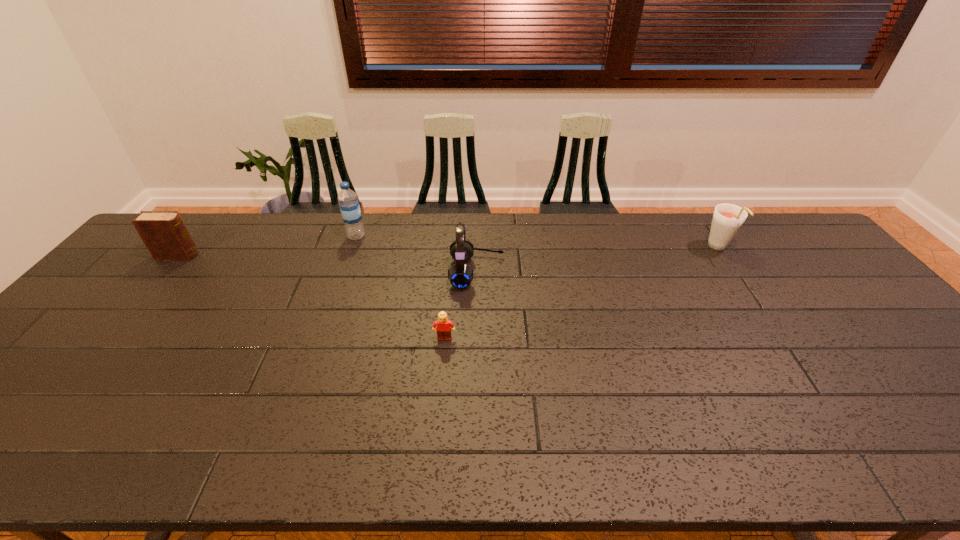
I want to click on the tallest object, so click(x=349, y=205).

The width and height of the screenshot is (960, 540). Identify the location of water bottle. 349,205.

Find the location of a particular element. This screenshot has width=960, height=540. the rightmost object is located at coordinates (727, 219).

Locate an element on the screen. headset is located at coordinates (460, 275).

At what (x,y) coordinates should I click in order to perform the action: click on the leftmost object. Please return your answer as a coordinate pair (x, y). This screenshot has width=960, height=540. Looking at the image, I should click on (164, 233).

The width and height of the screenshot is (960, 540). Find the location of `Lego`. Lego is located at coordinates (444, 326).

Find the location of a particular element. the shortest object is located at coordinates (x=444, y=326).

I want to click on free space located 0.240m on the label of the water bottle, so click(437, 237).

Locate an element on the screen. The image size is (960, 540). vacant area located 0.230m on the drink side of the rightmost object is located at coordinates (762, 312).

The image size is (960, 540). Find the location of `vacant region located 0.240m on the ear cushions of the headset`. vacant region located 0.240m on the ear cushions of the headset is located at coordinates (584, 272).